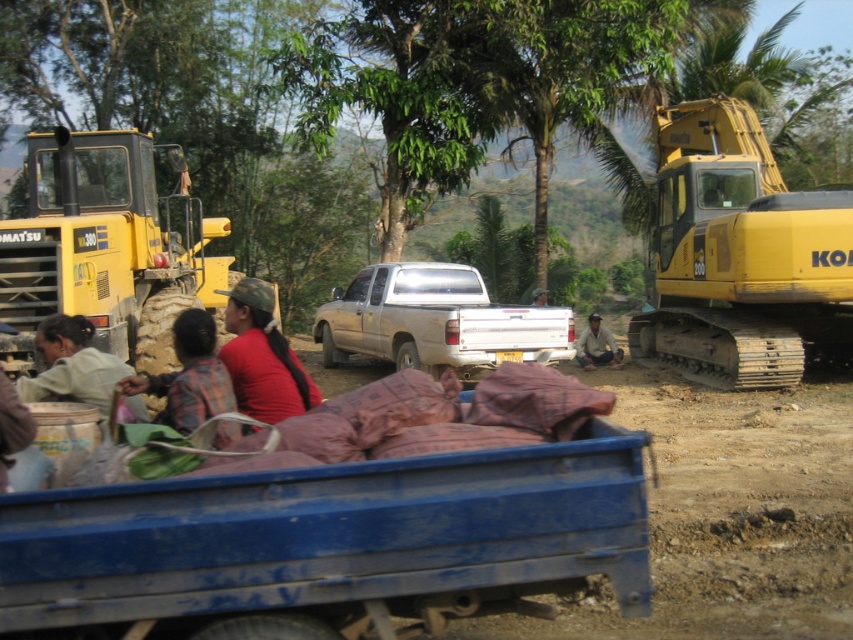
Question: Based on their relative distances, which object is farther from the camo fabric cap at center?

Choices:
 (A) yellow metallic excavator at right
 (B) white matte truck at center
 (C) camouflage fabric hat at center

Answer: (C)

Question: Which object is farther from the camera taking this photo?

Choices:
 (A) brown fabric at center
 (B) plaid fabric shirt at center

Answer: (A)

Question: Can you confirm if yellow metallic excavator at right is wider than white matte truck at center?

Choices:
 (A) no
 (B) yes

Answer: (A)

Question: Among these points, which one is nearest to the camera?

Choices:
 (A) (200, 365)
 (B) (51, 316)
 (C) (589, 353)
 (D) (45, 547)

Answer: (D)

Question: Is white matte truck at center to the right of brown fabric at center from the viewer's perspective?

Choices:
 (A) no
 (B) yes

Answer: (A)

Question: Is camo fabric cap at center thinner than light brown fabric at lower left?

Choices:
 (A) yes
 (B) no

Answer: (A)